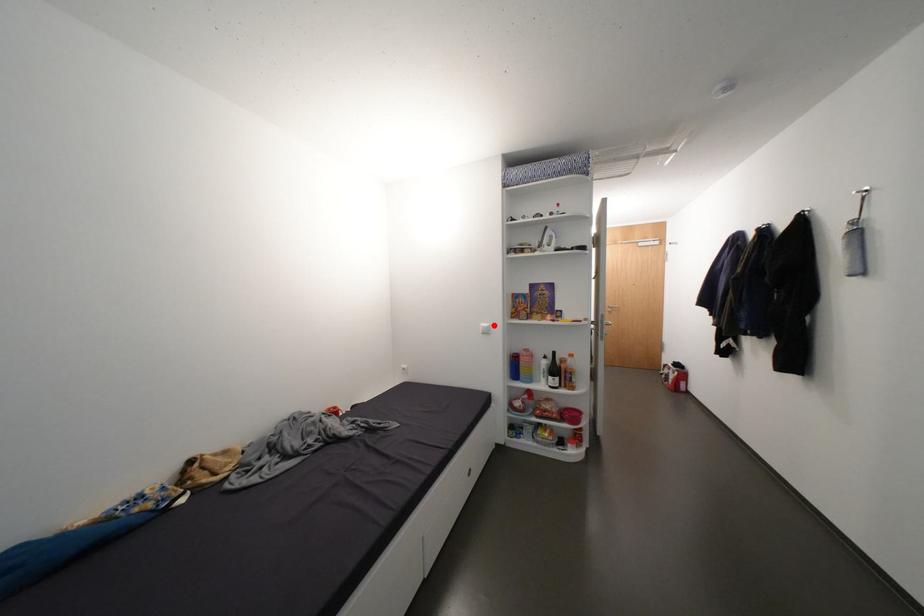
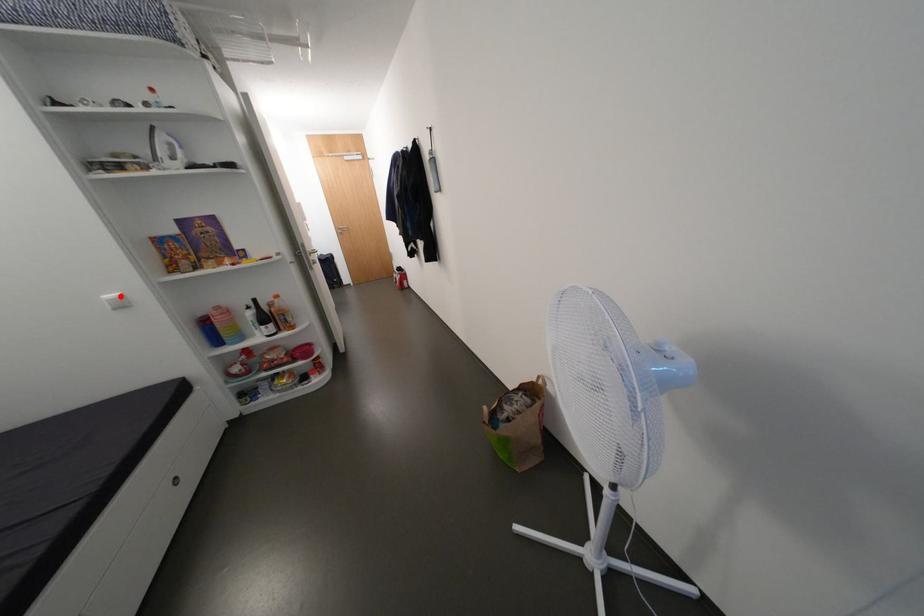
I am providing you with two images of the same scene from different viewpoints. A red point is marked on the first image and another point is marked on the second image. Do the highlighted points in image1 and image2 indicate the same real-world spot?

Yes